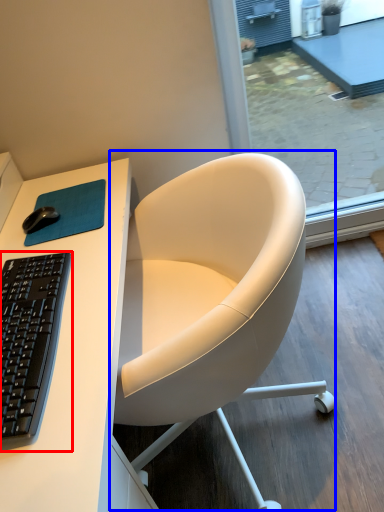
Question: Which object is further to the camera taking this photo, computer keyboard (highlighted by a red box) or chair (highlighted by a blue box)?

Choices:
 (A) computer keyboard
 (B) chair

Answer: (B)